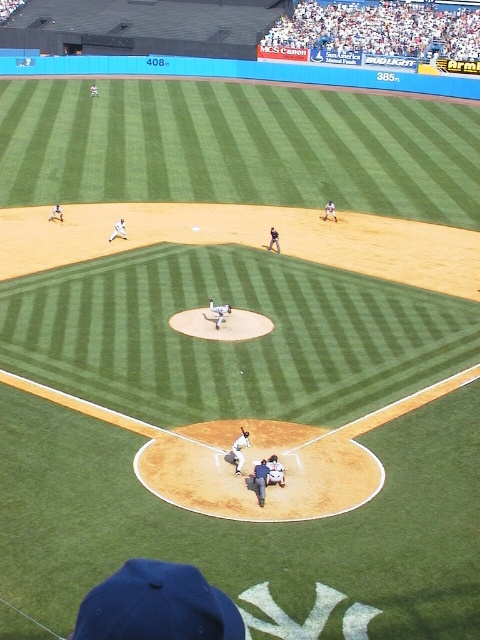
Can you confirm if blue fabric referee at center is bigger than white fabric catcher at center?

Indeed, blue fabric referee at center has a larger size compared to white fabric catcher at center.

Does blue fabric referee at center come behind white fabric catcher at center?

No, blue fabric referee at center is in front of white fabric catcher at center.

Is point (264, 496) closer to viewer compared to point (280, 480)?

Yes, it is.

The width and height of the screenshot is (480, 640). I want to click on blue fabric referee at center, so click(x=261, y=480).

Can you confirm if white jersey baseball team at upper center is positioned to the left of white fabric catcher at center?

No, white jersey baseball team at upper center is not to the left of white fabric catcher at center.

Locate an element on the screen. The image size is (480, 640). white jersey baseball team at upper center is located at coordinates (381, 28).

Is point (240, 454) positioned after point (241, 429)?

No, (240, 454) is in front of (241, 429).

Based on the photo, between white uniform bat at center and dark brown leather glove at home plate, which one is positioned higher?

dark brown leather glove at home plate

Does point (245, 436) come behind point (242, 428)?

No, (245, 436) is closer to viewer.

What are the coordinates of `white uniform bat at center` in the screenshot? It's located at (240, 449).